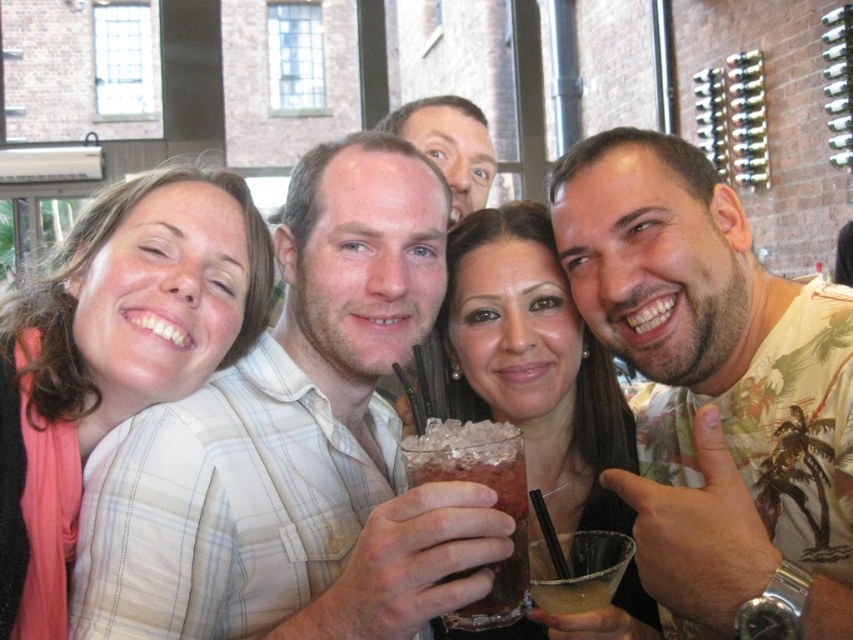
Which of these two, translucent glass cocktail at lower right or translucent glass drink at lower right, stands taller?

With more height is translucent glass cocktail at lower right.

Does translucent glass cocktail at lower right have a larger size compared to translucent glass drink at lower right?

Yes.

Is point (556, 580) closer to viewer compared to point (560, 611)?

Yes, point (556, 580) is in front of point (560, 611).

The height and width of the screenshot is (640, 853). Identify the location of translucent glass cocktail at lower right. (579, 570).

Which of these two, smooth skin woman at center or smooth skin face at upper center, stands shorter?

Standing shorter between the two is smooth skin face at upper center.

The image size is (853, 640). What do you see at coordinates (531, 364) in the screenshot? I see `smooth skin woman at center` at bounding box center [531, 364].

Locate an element on the screen. The image size is (853, 640). smooth skin woman at center is located at coordinates (531, 364).

Does point (190, 444) come farther from viewer compared to point (596, 577)?

Yes.

Which is in front, point (347, 227) or point (589, 582)?

Positioned in front is point (589, 582).

Image resolution: width=853 pixels, height=640 pixels. I want to click on light blue plaid shirt at center, so click(297, 445).